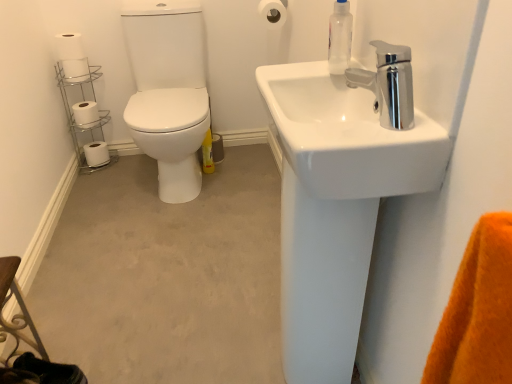
This screenshot has height=384, width=512. In order to click on free space above chrome/metallic toilet paper holder at left (from a real-world perspective) in this screenshot , I will do `click(76, 71)`.